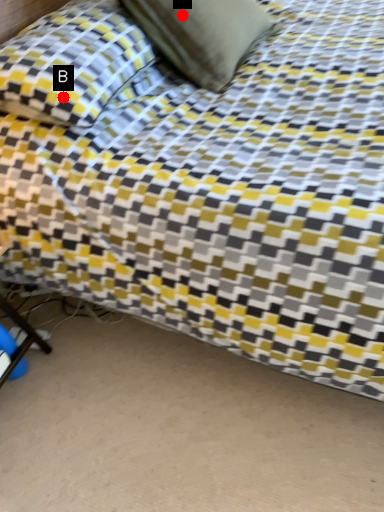
Question: Two points are circled on the image, labeled by A and B beside each circle. Which of the following is the farthest from the observer?

Choices:
 (A) A is further
 (B) B is further

Answer: (A)